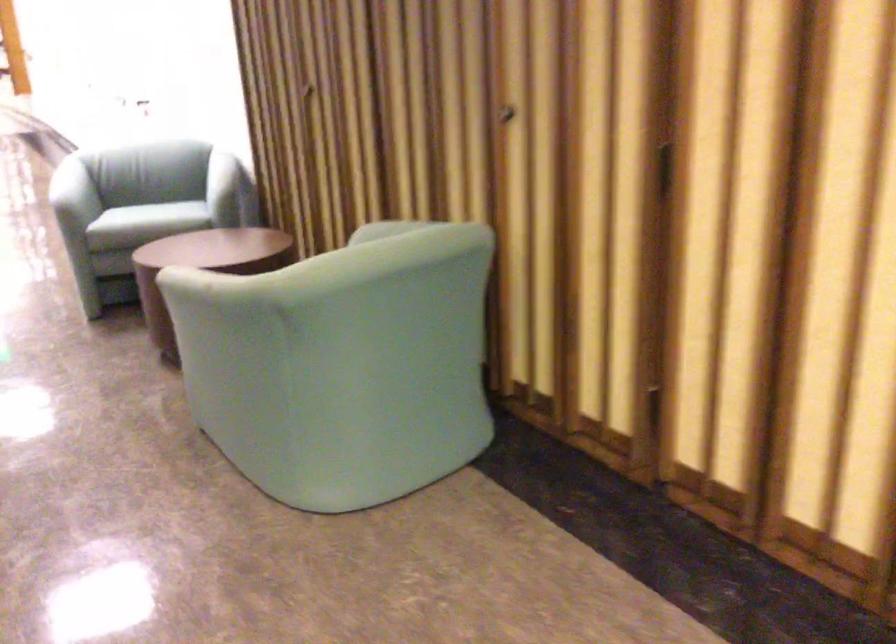
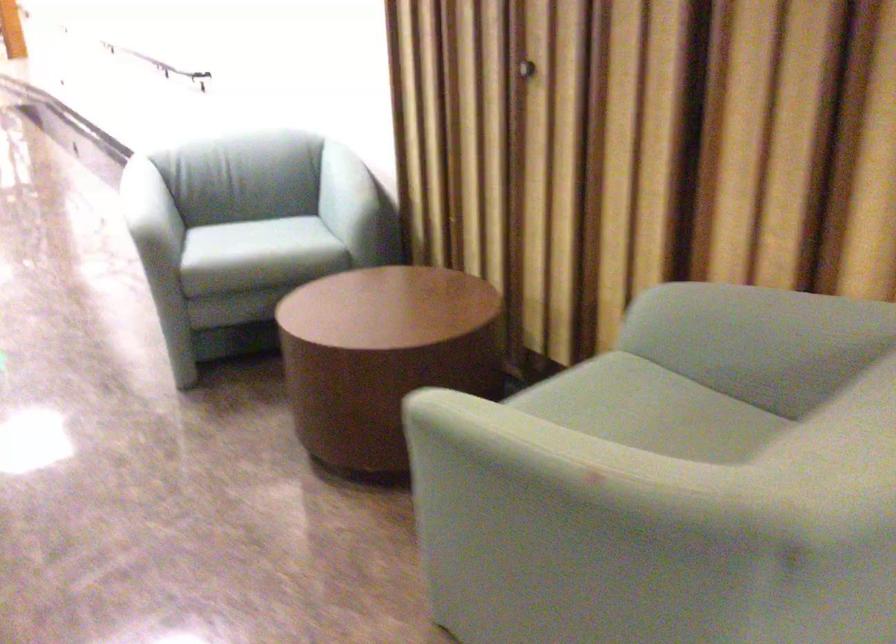
In the second image, find the point that corresponds to point 139,202 in the first image.

(265, 243)